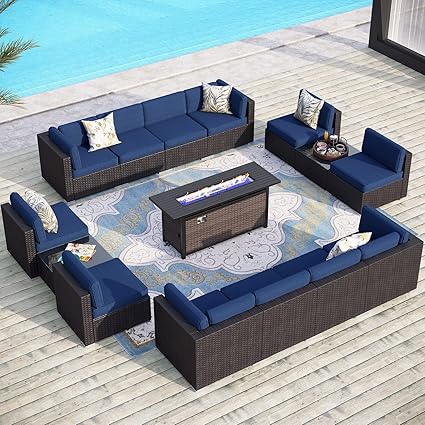
At what (x,y) coordinates should I click in order to perform the action: click on places to sit. Please return your answer as a coordinate pair (x, y). The height and width of the screenshot is (425, 425). Looking at the image, I should click on (144, 136), (72, 224), (121, 285), (287, 271), (362, 161), (293, 129).